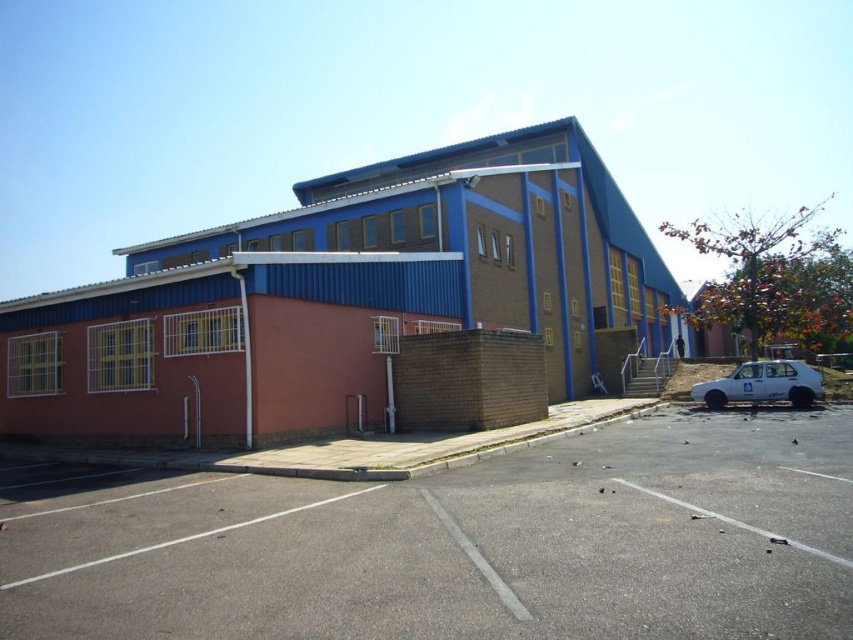
Question: Does gray asphalt parking lot at center lie in front of white matte car at lower right?

Choices:
 (A) yes
 (B) no

Answer: (A)

Question: Which point is farther from the camera taking this photo?

Choices:
 (A) (743, 378)
 (B) (548, 536)

Answer: (A)

Question: Is gray asphalt parking lot at center to the right of white matte car at lower right from the viewer's perspective?

Choices:
 (A) no
 (B) yes

Answer: (A)

Question: In this image, where is gray asphalt parking lot at center located relative to white matte car at lower right?

Choices:
 (A) right
 (B) left

Answer: (B)

Question: Which point is farther to the camera?

Choices:
 (A) (714, 397)
 (B) (729, 472)

Answer: (A)

Question: Which point appears farthest from the camera in this image?

Choices:
 (A) (747, 394)
 (B) (643, 486)

Answer: (A)